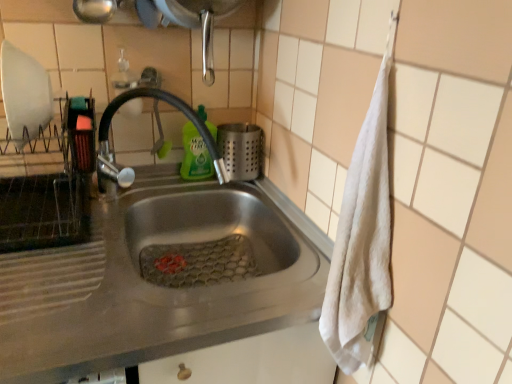
Locate an element on the screen. This screenshot has height=384, width=512. free space in front of green liquid at sink is located at coordinates click(x=179, y=193).